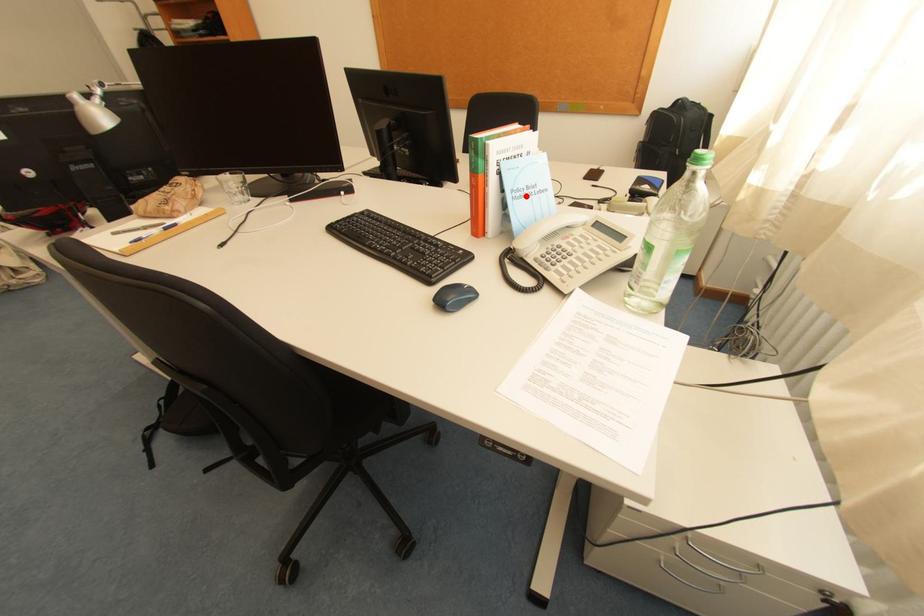
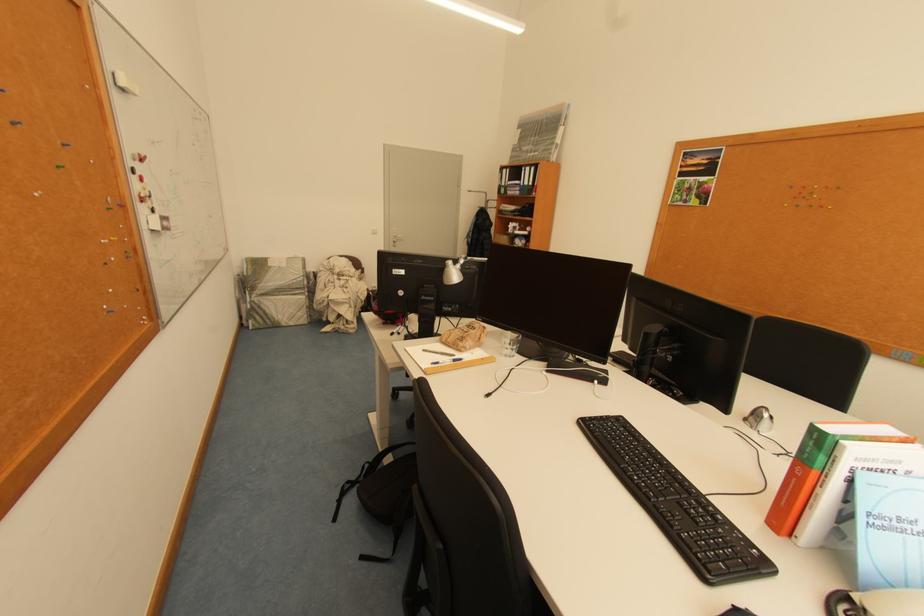
Question: A red point is marked in image1. In image2, is the corresponding 3D point closer to the camera or farther? Reply with the corresponding letter.

Choices:
 (A) The corresponding 3D point is closer.
 (B) The corresponding 3D point is farther.

Answer: (A)